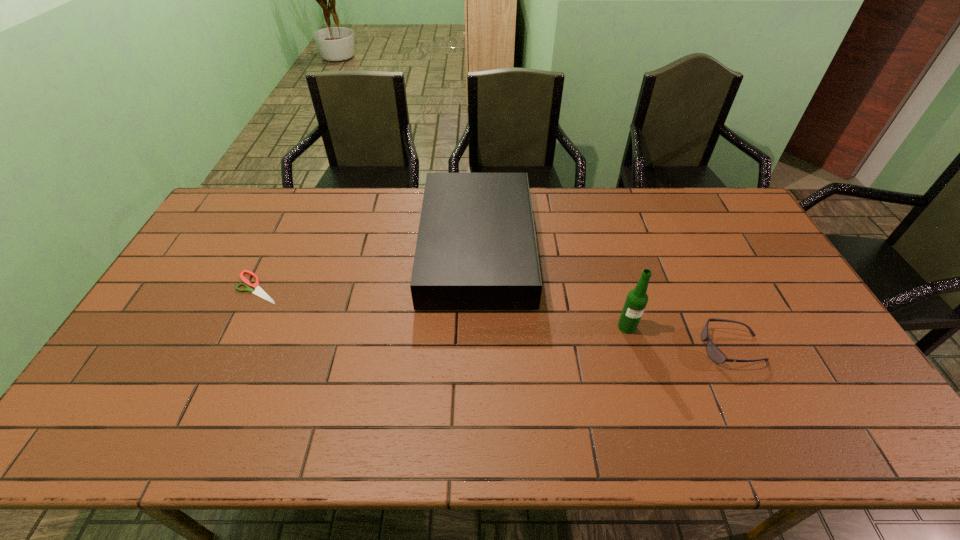
Locate an element on the screen. The width and height of the screenshot is (960, 540). vacant space located 0.110m on the lenses of the second shortest object is located at coordinates (661, 347).

The height and width of the screenshot is (540, 960). I want to click on free space located 0.150m on the lenses of the second shortest object, so click(x=646, y=347).

Locate an element on the screen. The height and width of the screenshot is (540, 960). vacant region located on the lenses of the second shortest object is located at coordinates (601, 347).

Where is `free space located on the left of the leftmost object`? free space located on the left of the leftmost object is located at coordinates (218, 288).

In order to click on object that is at the far edge in this screenshot , I will do `click(476, 249)`.

You are a GUI agent. You are given a task and a screenshot of the screen. Output one action in this format:
    pyautogui.click(x=<x>, y=<y>)
    Task: Click on the free region at the far edge of the desktop
    The image size is (960, 540).
    Given the screenshot: What is the action you would take?
    pyautogui.click(x=670, y=226)

You are a GUI agent. You are given a task and a screenshot of the screen. Output one action in this format:
    pyautogui.click(x=<x>, y=<y>)
    Task: Click on the vacant region at the near edge of the desktop
    The image size is (960, 540).
    Given the screenshot: What is the action you would take?
    pyautogui.click(x=339, y=449)

In the image, there is a desktop. Identify the location of vacant area at the right edge. (742, 263).

In order to click on vacant space at the far left corner of the desktop in this screenshot , I will do `click(252, 198)`.

Image resolution: width=960 pixels, height=540 pixels. I want to click on free space at the near left corner, so pos(103,434).